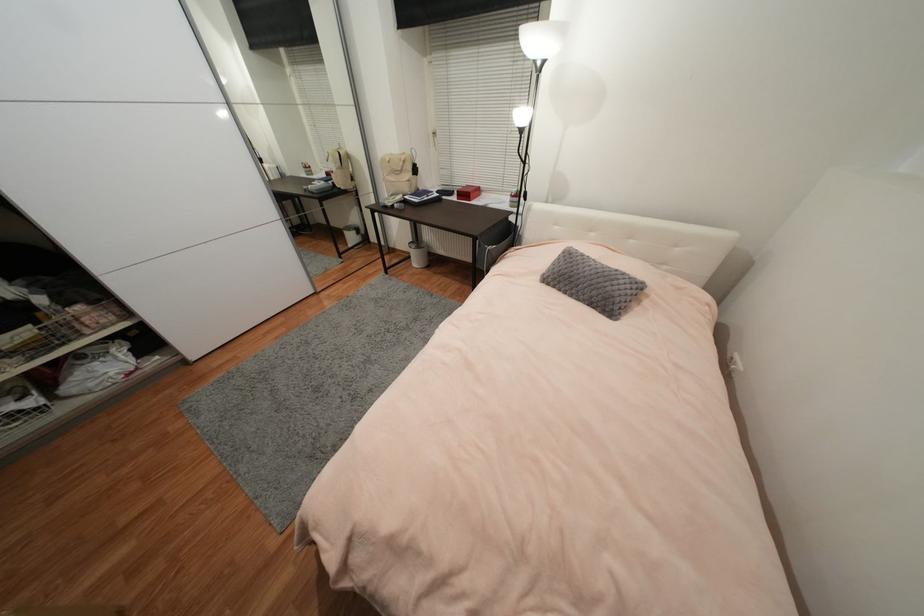
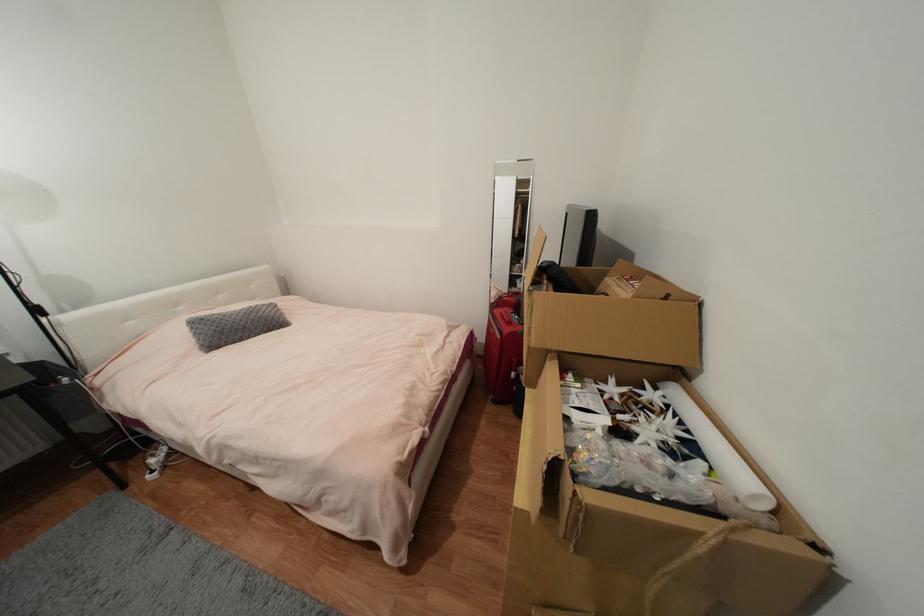
Find the pixel in the second image that matches point 591,274 in the first image.

(244, 320)